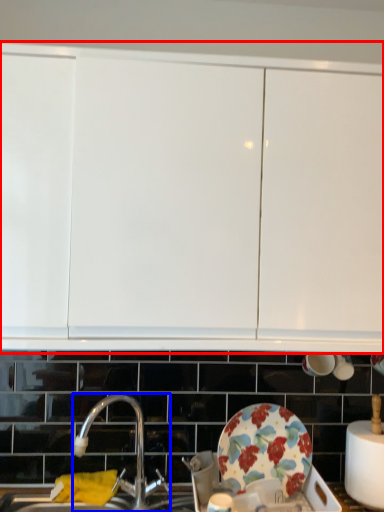
Question: Which of the following is the closest to the observer, cabinetry (highlighted by a red box) or tap (highlighted by a blue box)?

Choices:
 (A) cabinetry
 (B) tap

Answer: (A)